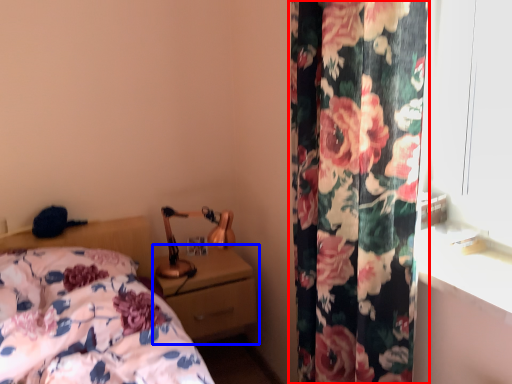
Question: Among these objects, which one is nearest to the camera, curtain (highlighted by a red box) or nightstand (highlighted by a blue box)?

Choices:
 (A) curtain
 (B) nightstand

Answer: (A)